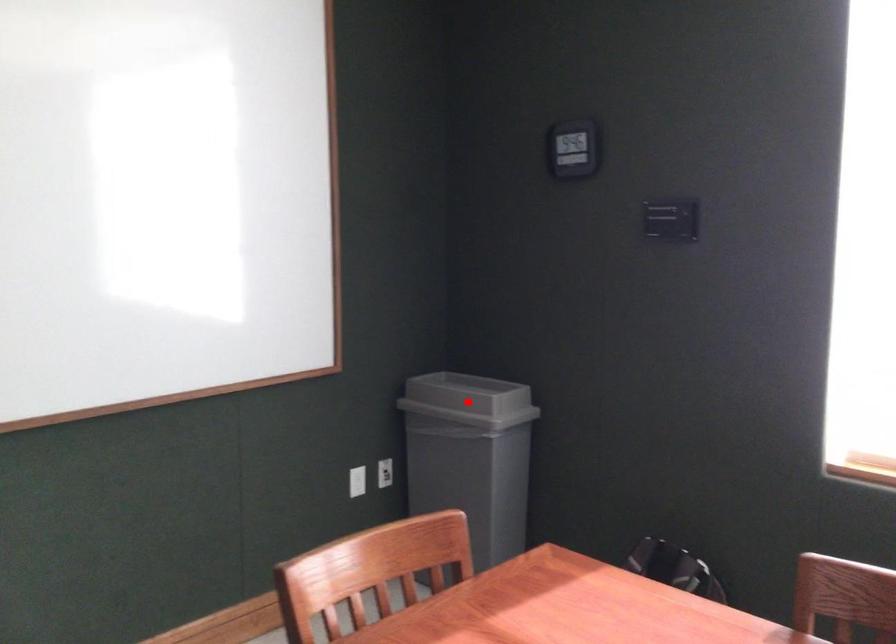
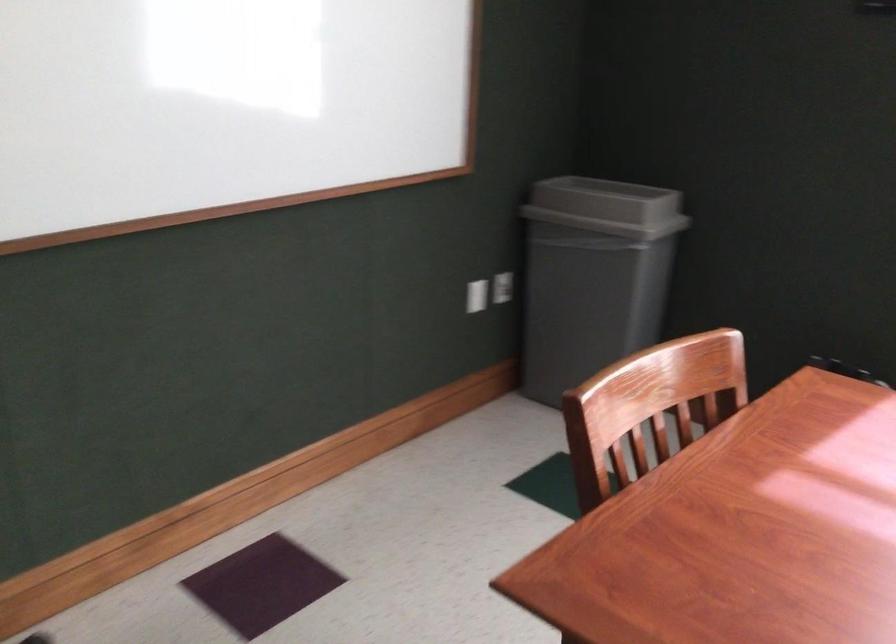
In the second image, find the point that corresponds to the highlighted location in the first image.

(607, 207)